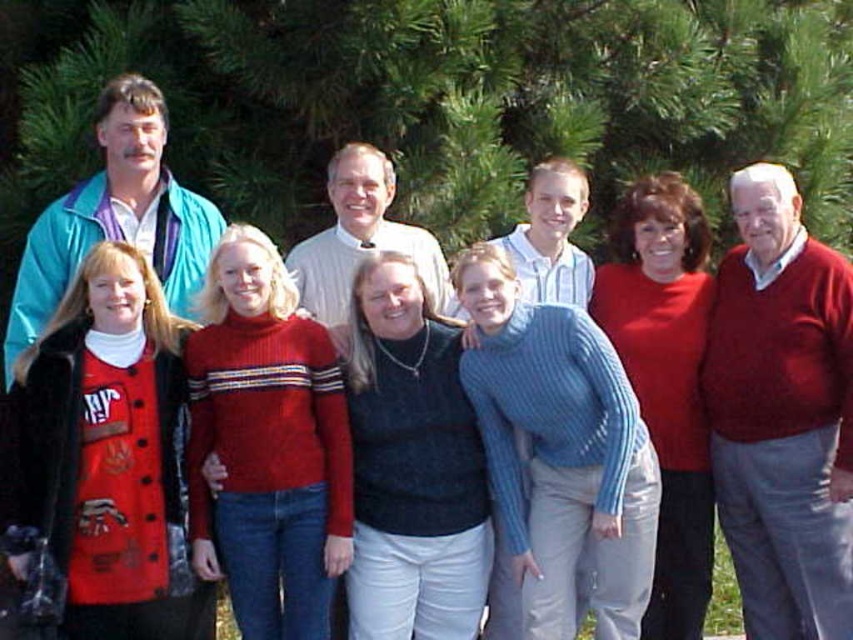
You are taking a photo of the group and notice the green leafy pine at upper center and the red sweater at right. Which object is higher in the image?

The green leafy pine at upper center is positioned over the red sweater at right, so it is higher in the image.

You are a photographer trying to capture a group photo with the green leafy pine at upper center and the red sweater at right. Since the pine is larger, how might you adjust your camera angle to ensure both objects are clearly visible in the frame?

The green leafy pine at upper center is bigger than the red sweater at right, so to ensure both are visible, you could zoom out slightly to include the entire pine while still capturing the red sweater at right in the foreground.